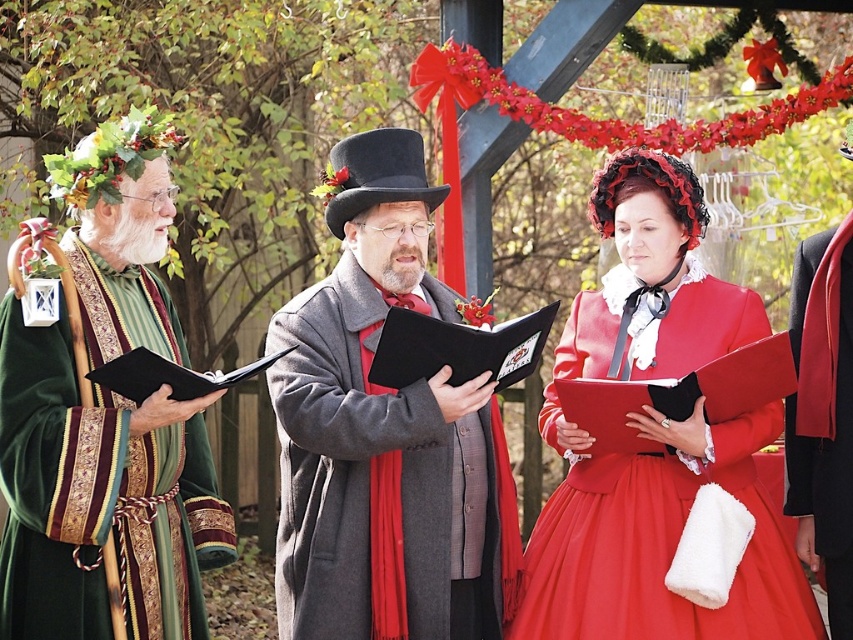
Question: Which point is farther from the camera taking this photo?

Choices:
 (A) (614, 369)
 (B) (834, 609)
 (C) (173, 524)

Answer: (A)

Question: Does velvet gray coat at center appear on the left side of black velvet robe at right?

Choices:
 (A) yes
 (B) no

Answer: (A)

Question: Which point appears farthest from the camera in this image?

Choices:
 (A) (635, 625)
 (B) (148, 166)

Answer: (B)

Question: Which object is positioned farthest from the velvet gray coat at center?

Choices:
 (A) black velvet robe at right
 (B) matte red dress at center

Answer: (A)

Question: Is velvet green robe at left thinner than matte red dress at center?

Choices:
 (A) no
 (B) yes

Answer: (B)

Question: Does black velvet robe at right appear on the left side of black felt dress hat at center?

Choices:
 (A) yes
 (B) no

Answer: (B)